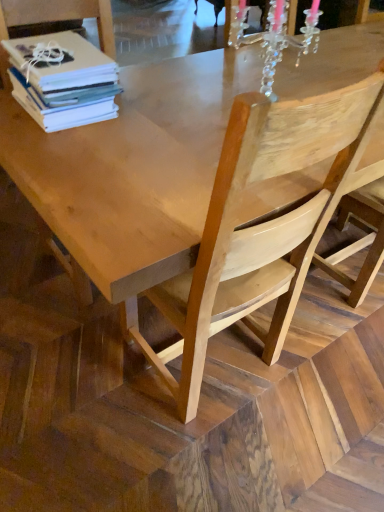
Question: Is white paper stack at upper left to the left of clear crystal chandelier at upper center from the viewer's perspective?

Choices:
 (A) no
 (B) yes

Answer: (B)

Question: Is white paper stack at upper left aimed at clear crystal chandelier at upper center?

Choices:
 (A) no
 (B) yes

Answer: (A)

Question: Considering the relative sizes of white paper stack at upper left and clear crystal chandelier at upper center in the image provided, is white paper stack at upper left shorter than clear crystal chandelier at upper center?

Choices:
 (A) yes
 (B) no

Answer: (A)

Question: From a real-world perspective, is white paper stack at upper left over clear crystal chandelier at upper center?

Choices:
 (A) yes
 (B) no

Answer: (B)

Question: Does white paper stack at upper left have a smaller size compared to clear crystal chandelier at upper center?

Choices:
 (A) yes
 (B) no

Answer: (A)

Question: Is white paper stack at upper left oriented away from clear crystal chandelier at upper center?

Choices:
 (A) yes
 (B) no

Answer: (B)

Question: Is natural wood chair at center wider than natural wood table at center?

Choices:
 (A) yes
 (B) no

Answer: (A)

Question: Does natural wood chair at center have a lesser width compared to natural wood table at center?

Choices:
 (A) no
 (B) yes

Answer: (A)

Question: Considering the relative positions of natural wood chair at center and natural wood table at center in the image provided, is natural wood chair at center to the left of natural wood table at center from the viewer's perspective?

Choices:
 (A) no
 (B) yes

Answer: (B)

Question: Is natural wood chair at center taller than natural wood table at center?

Choices:
 (A) no
 (B) yes

Answer: (A)

Question: Does natural wood chair at center turn towards natural wood table at center?

Choices:
 (A) no
 (B) yes

Answer: (A)

Question: Would you say natural wood chair at center is a long distance from natural wood table at center?

Choices:
 (A) no
 (B) yes

Answer: (A)

Question: Is natural wood chair at center, positioned as the 3th chair in right-to-left order, wider than clear crystal chandelier at upper center?

Choices:
 (A) no
 (B) yes

Answer: (B)